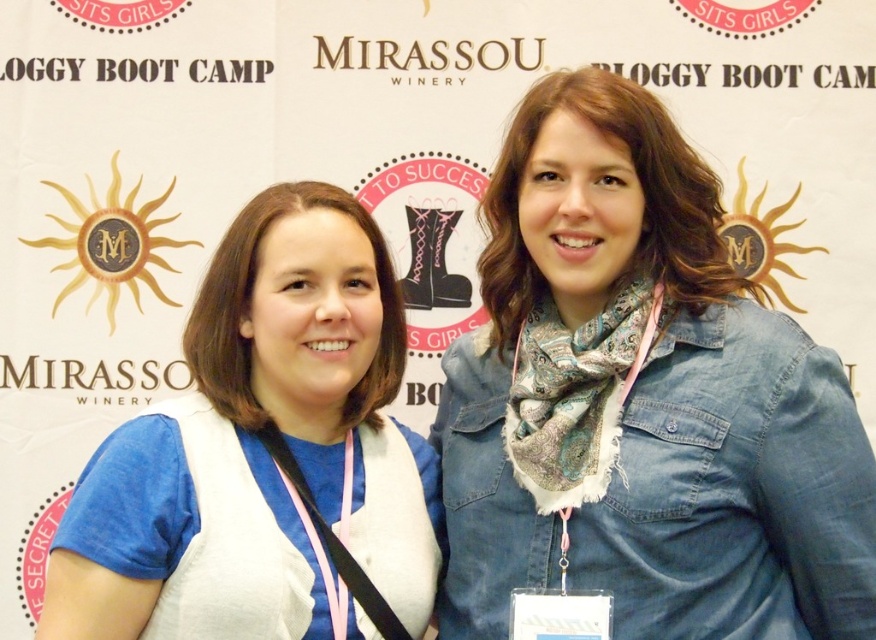
You are a photographer trying to capture a closeup of the white matte vest at center. Based on the scene description, where should you position your camera to ensure the vest is centered in the frame?

The white matte vest at center is located at point coordinates (x=263, y=456). To center it in the frame, position your camera so that the vest aligns with the center point of your viewfinder or screen.

You are at a conference and need to hand a document to the person wearing the denim jacket at upper right. If you can only walk 30 meters, can you reach them without moving?

The denim jacket at upper right is 32.58 meters away, so you cannot reach them without moving as you can only walk 30 meters.